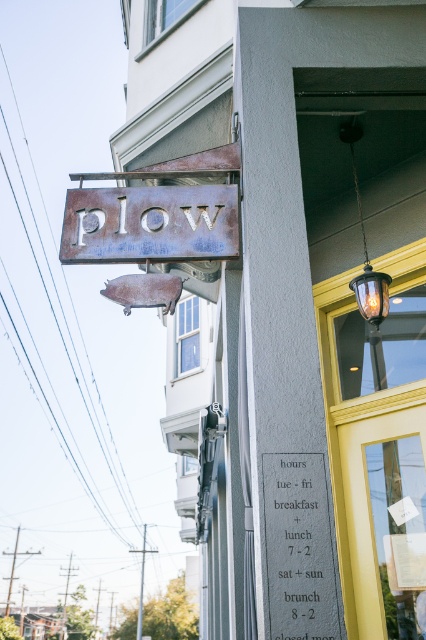
Question: Estimate the real-world distances between objects in this image. Which object is closer to the rusty metal sign at upper center?

Choices:
 (A) rustic metal sign at upper center
 (B) black metal sign at center
 (C) translucent glass lamp at upper center

Answer: (B)

Question: Is the position of rustic metal sign at upper center more distant than that of black metal sign at center?

Choices:
 (A) no
 (B) yes

Answer: (B)

Question: Is black metal sign at center to the right of translucent glass lamp at upper center from the viewer's perspective?

Choices:
 (A) no
 (B) yes

Answer: (A)

Question: Is rustic metal sign at upper center wider than black metal sign at center?

Choices:
 (A) no
 (B) yes

Answer: (B)

Question: Which object appears closest to the camera in this image?

Choices:
 (A) black metal sign at center
 (B) rusty metal sign at upper center
 (C) rustic metal sign at upper center

Answer: (A)

Question: Which point is closer to the camera?

Choices:
 (A) (383, 278)
 (B) (327, 504)
 (C) (314, 131)
 (D) (131, 260)

Answer: (B)